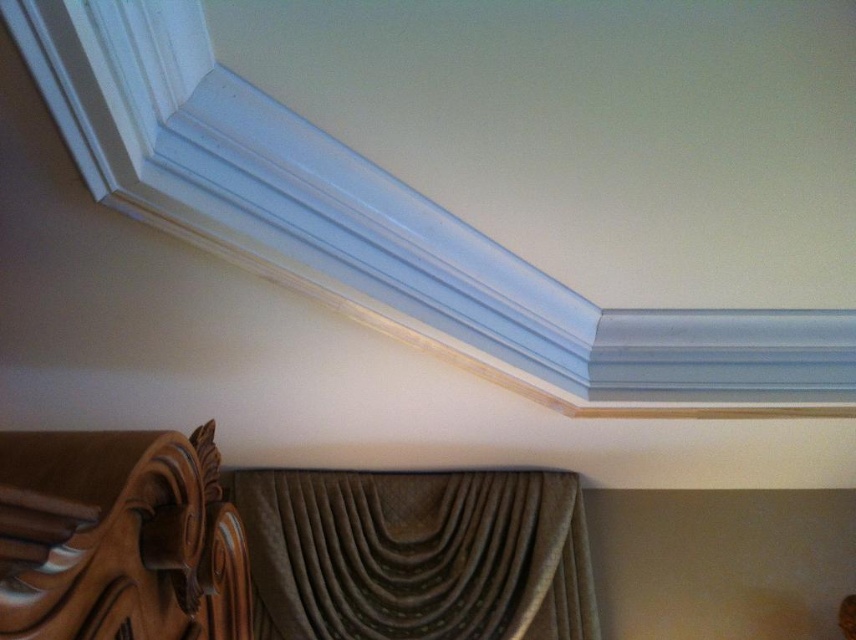
Question: Which object is the farthest from the brown carved wood bed at lower left?

Choices:
 (A) white smooth crown molding at upper center
 (B) brown textured curtain at upper center

Answer: (B)

Question: Is brown textured curtain at upper center to the left of brown carved wood bed at lower left from the viewer's perspective?

Choices:
 (A) no
 (B) yes

Answer: (A)

Question: From the image, what is the correct spatial relationship of white smooth crown molding at upper center in relation to brown carved wood bed at lower left?

Choices:
 (A) left
 (B) right

Answer: (B)

Question: Among these points, which one is nearest to the camera?

Choices:
 (A) (562, 515)
 (B) (397, 323)
 (C) (153, 532)

Answer: (C)

Question: Does white smooth crown molding at upper center have a lesser width compared to brown carved wood bed at lower left?

Choices:
 (A) no
 (B) yes

Answer: (A)

Question: Among these points, which one is nearest to the camera?

Choices:
 (A) (591, 364)
 (B) (562, 580)
 (C) (143, 435)

Answer: (C)